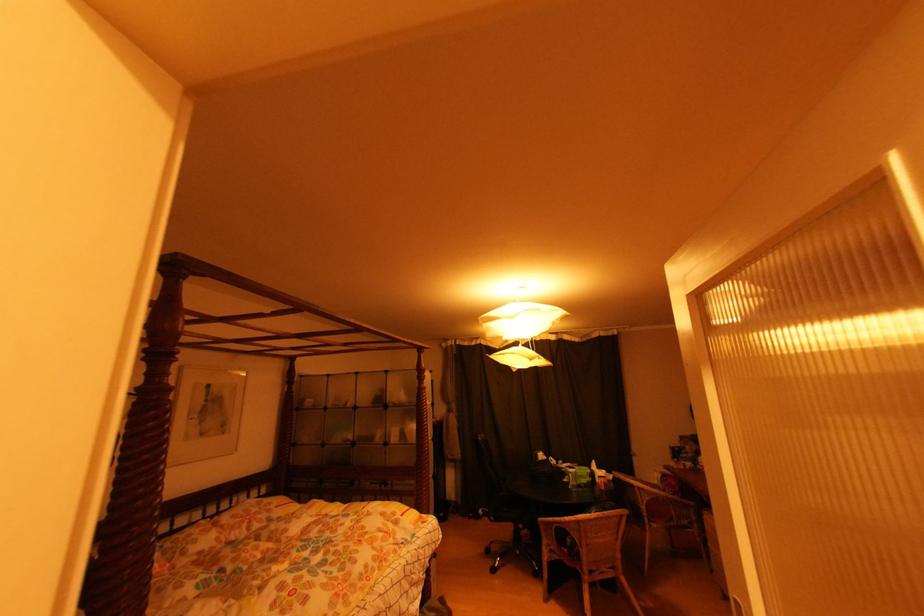
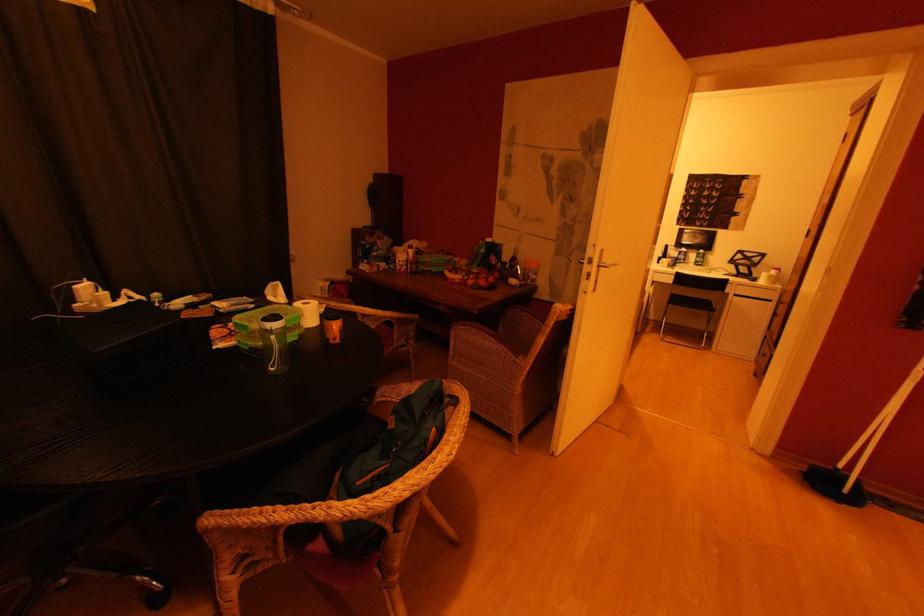
Find the pixel in the second image that matches point 618,479 in the first image.

(331, 310)